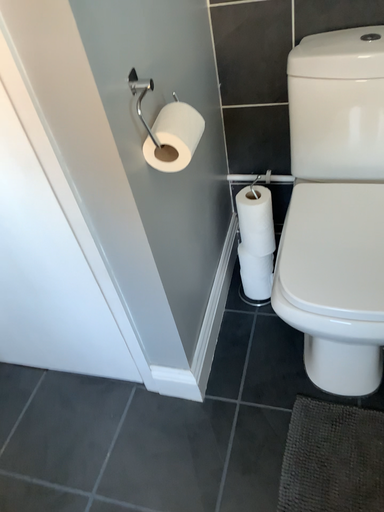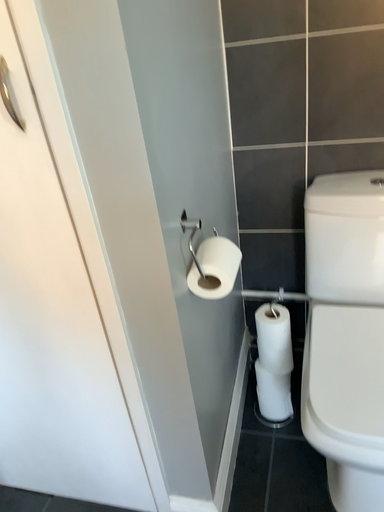
Question: How did the camera likely rotate when shooting the video?

Choices:
 (A) rotated downward
 (B) rotated upward

Answer: (B)